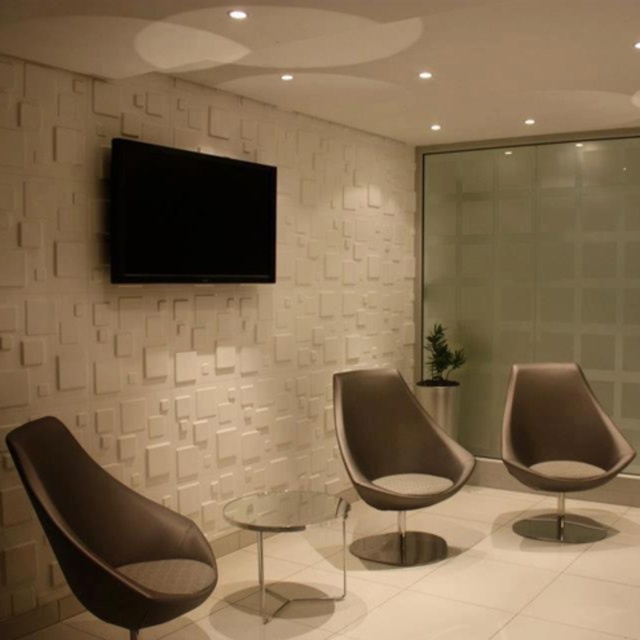
Which is above, matte black chair at lower left or matte brown chair at center?

matte brown chair at center

Who is positioned more to the right, matte black chair at lower left or matte brown chair at center?

Positioned to the right is matte brown chair at center.

This screenshot has width=640, height=640. What do you see at coordinates (109, 532) in the screenshot?
I see `matte black chair at lower left` at bounding box center [109, 532].

This screenshot has width=640, height=640. What are the coordinates of `matte black chair at lower left` in the screenshot? It's located at (109, 532).

Between point (413, 429) and point (298, 512), which one is positioned behind?

The point (413, 429) is behind.

Is matte brown chair at center below transparent glass table at center?

Incorrect, matte brown chair at center is not positioned below transparent glass table at center.

The image size is (640, 640). Find the location of `matte brown chair at center`. matte brown chair at center is located at coordinates (394, 460).

Describe the element at coordinates (394, 460) in the screenshot. I see `matte brown chair at center` at that location.

At what (x,y) coordinates should I click in order to perform the action: click on matte brown chair at center. Please return your answer as a coordinate pair (x, y). Looking at the image, I should click on (394, 460).

At what (x,y) coordinates should I click in order to perform the action: click on matte brown chair at center. Please return your answer as a coordinate pair (x, y). This screenshot has width=640, height=640. Looking at the image, I should click on (394, 460).